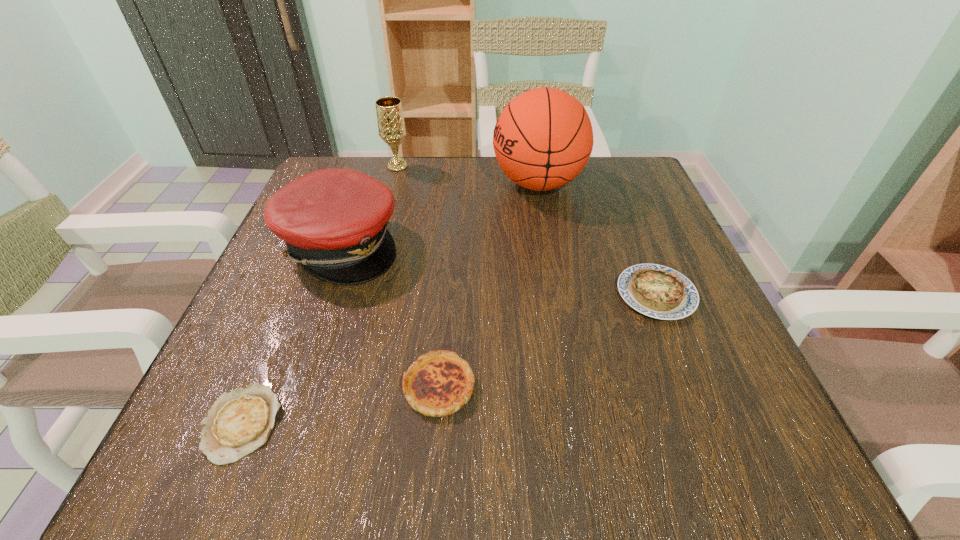
What are the coordinates of `quiche located at the left edge` in the screenshot? It's located at (239, 422).

Locate an element on the screen. This screenshot has width=960, height=540. basketball located in the right edge section of the desktop is located at coordinates (542, 140).

The width and height of the screenshot is (960, 540). Identify the location of quiche situated at the right edge. pos(657,291).

The width and height of the screenshot is (960, 540). What are the coordinates of `chalice located at the far left corner` in the screenshot? It's located at (391, 126).

Identify the location of cap that is at the far left corner. (334, 221).

Locate an element on the screen. The width and height of the screenshot is (960, 540). object that is at the near left corner is located at coordinates (239, 422).

The width and height of the screenshot is (960, 540). In order to click on object that is at the far right corner in this screenshot , I will do `click(542, 140)`.

In the image, there is a desktop. At what (x,y) coordinates should I click in order to perform the action: click on free space at the far edge. Please return your answer as a coordinate pair (x, y). Looking at the image, I should click on (490, 205).

Image resolution: width=960 pixels, height=540 pixels. In the image, there is a desktop. In order to click on vacant space at the near edge in this screenshot , I will do `click(585, 423)`.

In the image, there is a desktop. At what (x,y) coordinates should I click in order to perform the action: click on vacant space at the left edge. Please return your answer as a coordinate pair (x, y). This screenshot has width=960, height=540. Looking at the image, I should click on (335, 307).